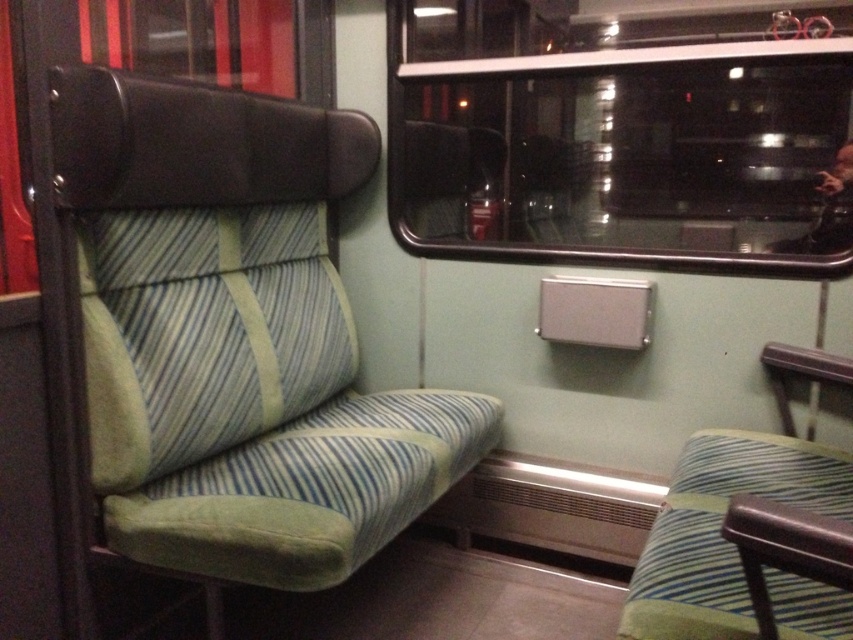
Question: Which point is farther to the camera?

Choices:
 (A) (809, 602)
 (B) (292, 403)
 (C) (515, 236)

Answer: (C)

Question: Does transparent glass window at upper center appear on the left side of metallic silver coach at upper right?

Choices:
 (A) no
 (B) yes

Answer: (B)

Question: Which of the following is the closest to the observer?

Choices:
 (A) (833, 595)
 (B) (79, 460)

Answer: (A)

Question: Does transparent glass window at upper center appear over metallic silver coach at upper right?

Choices:
 (A) yes
 (B) no

Answer: (A)

Question: Which point appears closest to the camera in this image?

Choices:
 (A) (816, 353)
 (B) (590, 244)
 (C) (851, 148)
 (D) (102, 408)

Answer: (D)

Question: Is transparent glass window at upper center to the left of metallic silver coach at upper right from the viewer's perspective?

Choices:
 (A) no
 (B) yes

Answer: (B)